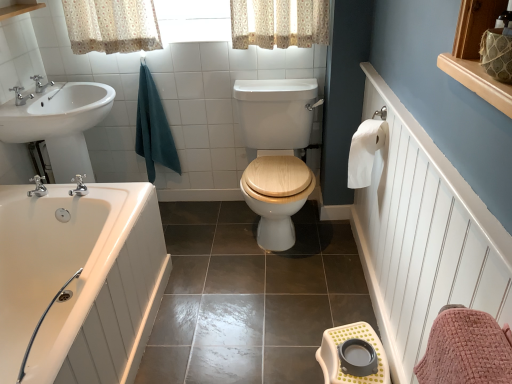
Question: Is brushed metal faucet at upper left, the first tap in the top-to-bottom sequence, turned away from white glossy sink at left?

Choices:
 (A) no
 (B) yes

Answer: (A)

Question: From the image's perspective, does brushed metal faucet at upper left, the second tap viewed from the front, appear lower than white glossy sink at left?

Choices:
 (A) no
 (B) yes

Answer: (A)

Question: Considering the relative sizes of brushed metal faucet at upper left, the first tap when ordered from back to front, and white glossy sink at left in the image provided, is brushed metal faucet at upper left, the first tap when ordered from back to front, wider than white glossy sink at left?

Choices:
 (A) no
 (B) yes

Answer: (A)

Question: Does brushed metal faucet at upper left, the first tap in the top-to-bottom sequence, touch white glossy sink at left?

Choices:
 (A) yes
 (B) no

Answer: (B)

Question: Is brushed metal faucet at upper left, the second tap viewed from the front, positioned in front of white glossy sink at left?

Choices:
 (A) yes
 (B) no

Answer: (B)

Question: Considering the positions of wooden at center and teal cotton towel at upper left in the image, is wooden at center wider or thinner than teal cotton towel at upper left?

Choices:
 (A) thin
 (B) wide

Answer: (B)

Question: From a real-world perspective, is wooden at center positioned above or below teal cotton towel at upper left?

Choices:
 (A) below
 (B) above

Answer: (A)

Question: Considering their positions, is wooden at center located in front of or behind teal cotton towel at upper left?

Choices:
 (A) behind
 (B) front

Answer: (B)

Question: Is point (249, 82) positioned closer to the camera than point (158, 144)?

Choices:
 (A) farther
 (B) closer

Answer: (B)

Question: Is white wood balustrade at upper left bigger or smaller than wooden at center?

Choices:
 (A) big
 (B) small

Answer: (B)

Question: Is point (35, 0) positioned closer to the camera than point (285, 192)?

Choices:
 (A) closer
 (B) farther

Answer: (A)

Question: Looking at their shapes, would you say white wood balustrade at upper left is wider or thinner than wooden at center?

Choices:
 (A) wide
 (B) thin

Answer: (B)

Question: From the image's perspective, relative to wooden at center, is white wood balustrade at upper left above or below?

Choices:
 (A) above
 (B) below

Answer: (A)

Question: In the image, is wooden at center positioned in front of or behind silver metallic faucet at upper left, placed as the first tap when sorted from bottom to top?

Choices:
 (A) behind
 (B) front

Answer: (B)

Question: Considering the positions of point (303, 119) and point (24, 97), is point (303, 119) closer or farther from the camera than point (24, 97)?

Choices:
 (A) closer
 (B) farther

Answer: (B)